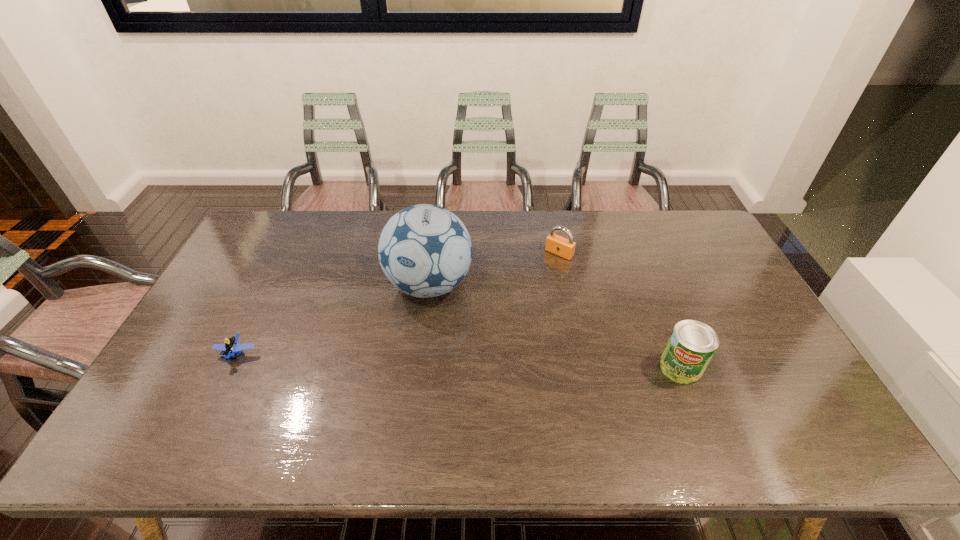
This screenshot has height=540, width=960. What are the coordinates of `free area in between the shortest object and the padlock` in the screenshot? It's located at (398, 303).

Locate an element on the screen. empty location between the second shortest object and the can is located at coordinates (620, 310).

Find the location of a particular element. free space between the second object from left to right and the third object from left to right is located at coordinates (494, 269).

Identify which object is the closest to the leftmost object. Please provide its 2D coordinates. Your answer should be formatted as a tuple, i.e. [(x, y)], where the tuple contains the x and y coordinates of a point satisfying the conditions above.

[(425, 251)]

Identify which object is located as the second nearest to the second shortest object. Please provide its 2D coordinates. Your answer should be formatted as a tuple, i.e. [(x, y)], where the tuple contains the x and y coordinates of a point satisfying the conditions above.

[(692, 344)]

Image resolution: width=960 pixels, height=540 pixels. In order to click on free space in the image that satisfies the following two spatial constraints: 1. on the front side of the second object from left to right; 2. on the left side of the second tallest object in this screenshot , I will do `click(420, 368)`.

Where is `free space that satisfies the following two spatial constraints: 1. on the front-facing side of the rightmost object; 2. on the right side of the Lego`? This screenshot has height=540, width=960. free space that satisfies the following two spatial constraints: 1. on the front-facing side of the rightmost object; 2. on the right side of the Lego is located at coordinates (230, 368).

Image resolution: width=960 pixels, height=540 pixels. Identify the location of free space that satisfies the following two spatial constraints: 1. on the front side of the rightmost object; 2. on the left side of the second shortest object. (583, 368).

I want to click on free spot that satisfies the following two spatial constraints: 1. on the front-facing side of the can; 2. on the right side of the Lego, so click(x=230, y=368).